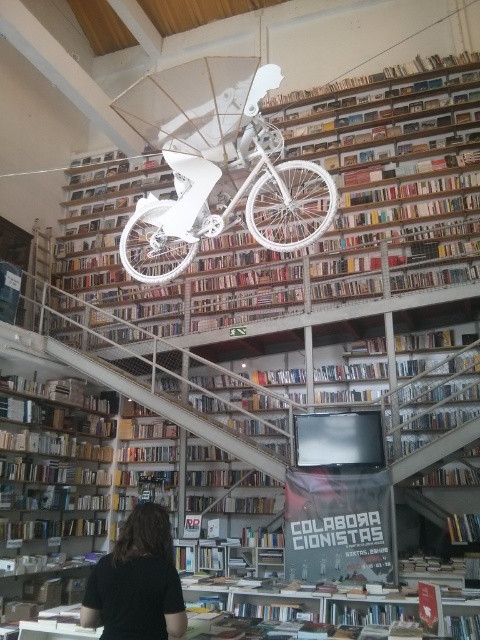
Question: Is white matte bicycle at center bigger than wooden bookshelf at lower left?

Choices:
 (A) no
 (B) yes

Answer: (A)

Question: Is white matte bicycle at center behind wooden bookshelf at lower left?

Choices:
 (A) yes
 (B) no

Answer: (B)

Question: Which is farther from the black shirt at lower center?

Choices:
 (A) white matte bicycle at center
 (B) wooden bookshelf at lower left

Answer: (B)

Question: Does white matte bookcase at center have a smaller size compared to black shirt at lower center?

Choices:
 (A) yes
 (B) no

Answer: (B)

Question: Estimate the real-world distances between objects in this image. Which object is farther from the white matte bookcase at center?

Choices:
 (A) black shirt at lower center
 (B) wooden bookshelf at lower left
 (C) white matte bicycle at center

Answer: (A)

Question: Which of the following is the closest to the observer?

Choices:
 (A) (1, 504)
 (B) (367, 81)
 (C) (205, 144)

Answer: (C)